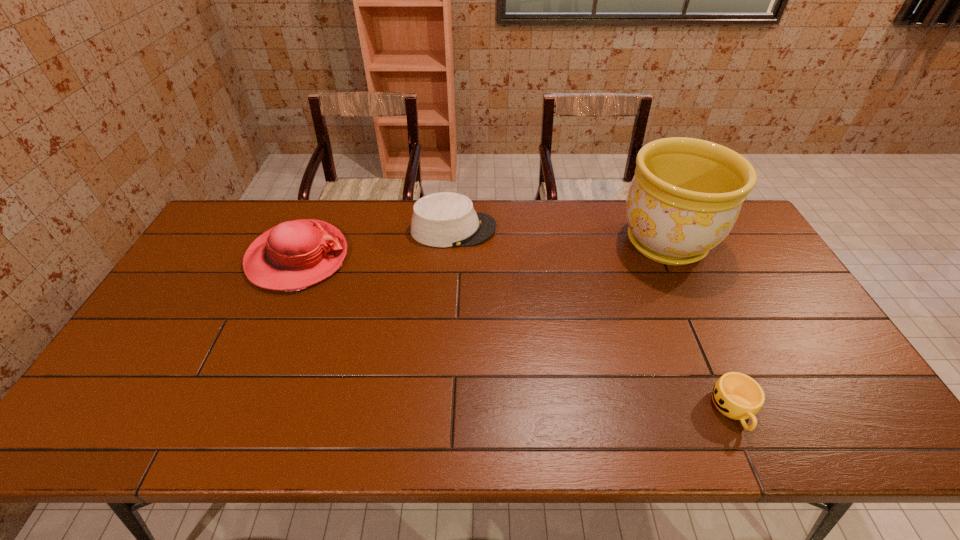
Locate an element on the screen. Image resolution: width=960 pixels, height=540 pixels. free spot located on the back of the shortest object is located at coordinates (681, 289).

I want to click on flowerpot that is at the far edge, so click(x=686, y=195).

Locate an element on the screen. Image resolution: width=960 pixels, height=540 pixels. object located at the near edge is located at coordinates (736, 395).

At what (x,y) coordinates should I click in order to perform the action: click on object situated at the right edge. Please return your answer as a coordinate pair (x, y). Looking at the image, I should click on (686, 195).

You are a GUI agent. You are given a task and a screenshot of the screen. Output one action in this format:
    pyautogui.click(x=<x>, y=<y>)
    Task: Click on the object that is at the far right corner
    The image size is (960, 540).
    Given the screenshot: What is the action you would take?
    pos(686,195)

This screenshot has height=540, width=960. In the image, there is a desktop. Identify the location of vacant space at the far edge. (330, 205).

The height and width of the screenshot is (540, 960). Identify the location of vacant space at the near edge of the desktop. (560, 417).

You are a GUI agent. You are given a task and a screenshot of the screen. Output one action in this format:
    pyautogui.click(x=<x>, y=<y>)
    Task: Click on the vacant position at the left edge of the desktop
    The image size is (960, 540).
    Given the screenshot: What is the action you would take?
    pyautogui.click(x=193, y=294)

In order to click on vacant area at the right edge of the desktop in this screenshot , I will do `click(772, 319)`.

Find the location of a particular element. This screenshot has width=960, height=540. vacant space in between the third object from right to left and the left hat is located at coordinates (375, 244).